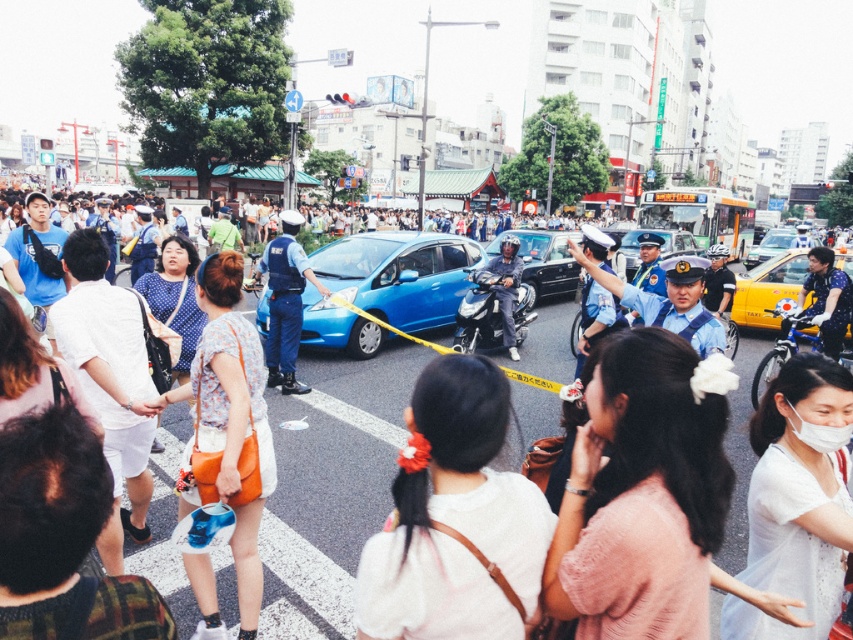
Can you confirm if shiny blue car at center is thinner than light blue uniform at center?

No.

Does shiny blue car at center have a larger size compared to light blue uniform at center?

Yes, shiny blue car at center is bigger than light blue uniform at center.

Is point (363, 298) closer to camera compared to point (672, 324)?

No, it is not.

Locate an element on the screen. shiny blue car at center is located at coordinates (399, 275).

Who is taller, white sheer blouse at lower right or polka dot shirt at center?

polka dot shirt at center is taller.

Is white sheer blouse at lower right wider than polka dot shirt at center?

Correct, the width of white sheer blouse at lower right exceeds that of polka dot shirt at center.

Which is in front, point (762, 541) or point (839, 269)?

Point (762, 541) is more forward.

This screenshot has width=853, height=640. I want to click on white sheer blouse at lower right, so click(x=798, y=499).

Describe the element at coordinates (641, 488) in the screenshot. Image resolution: width=853 pixels, height=640 pixels. I see `light pink fabric at center` at that location.

Image resolution: width=853 pixels, height=640 pixels. I want to click on light pink fabric at center, so click(x=641, y=488).